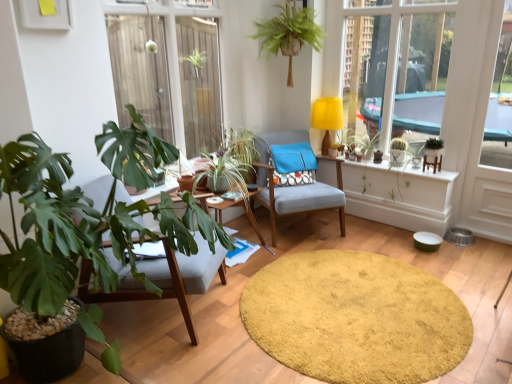
Question: Can you confirm if green leafy plant at upper center, placed as the second houseplant when sorted from front to back, is taller than matte gray chair at left, arranged as the first chair when viewed from the front?

Choices:
 (A) yes
 (B) no

Answer: (B)

Question: Does green leafy plant at upper center, the 3th houseplant in the left-to-right sequence, have a smaller size compared to matte gray chair at left, which ranks as the 2th chair in right-to-left order?

Choices:
 (A) yes
 (B) no

Answer: (A)

Question: Considering the relative sizes of green leafy plant at upper center, the 3th houseplant in the left-to-right sequence, and matte gray chair at left, arranged as the first chair when viewed from the front, in the image provided, is green leafy plant at upper center, the 3th houseplant in the left-to-right sequence, wider than matte gray chair at left, arranged as the first chair when viewed from the front,?

Choices:
 (A) yes
 (B) no

Answer: (B)

Question: Is green leafy plant at upper center, the 3th houseplant in the left-to-right sequence, shorter than matte gray chair at left, which ranks as the 2th chair in right-to-left order?

Choices:
 (A) yes
 (B) no

Answer: (A)

Question: Is green leafy plant at upper center, positioned as the 4th houseplant in back-to-front order, at the right side of matte gray chair at left, arranged as the 1th chair when viewed from the left?

Choices:
 (A) no
 (B) yes

Answer: (B)

Question: Is point [292, 147] closer or farther from the camera than point [281, 16]?

Choices:
 (A) closer
 (B) farther

Answer: (B)

Question: From the image's perspective, is blue fabric pillow at center located above or below green leafy plant at upper center, the 3th houseplant in the left-to-right sequence?

Choices:
 (A) below
 (B) above

Answer: (A)

Question: In terms of width, does blue fabric pillow at center look wider or thinner when compared to green leafy plant at upper center, positioned as the 4th houseplant in back-to-front order?

Choices:
 (A) thin
 (B) wide

Answer: (A)

Question: From their relative heights in the image, would you say blue fabric pillow at center is taller or shorter than green leafy plant at upper center, positioned as the 4th houseplant in back-to-front order?

Choices:
 (A) short
 (B) tall

Answer: (A)

Question: Relative to green leafy plant at left, the 5th houseplant viewed from the back, is green leafy plant at right, placed as the 5th houseplant when sorted from left to right, in front or behind?

Choices:
 (A) front
 (B) behind

Answer: (B)

Question: From the image's perspective, is green leafy plant at right, which appears as the first houseplant when viewed from the right, positioned above or below green leafy plant at left, the 5th houseplant viewed from the back?

Choices:
 (A) below
 (B) above

Answer: (B)

Question: Is point (441, 145) closer or farther from the camera than point (83, 201)?

Choices:
 (A) farther
 (B) closer

Answer: (A)

Question: Is green leafy plant at right, which appears as the first houseplant when viewed from the right, wider or thinner than green leafy plant at left, placed as the first houseplant when sorted from left to right?

Choices:
 (A) thin
 (B) wide

Answer: (A)

Question: In the image, is green matte cactus at upper right, which appears as the 2th plant when viewed from the left, on the left side or the right side of yellow shaggy rug at center?

Choices:
 (A) right
 (B) left

Answer: (A)

Question: Is green matte cactus at upper right, which appears as the first plant when viewed from the right, taller or shorter than yellow shaggy rug at center?

Choices:
 (A) tall
 (B) short

Answer: (A)